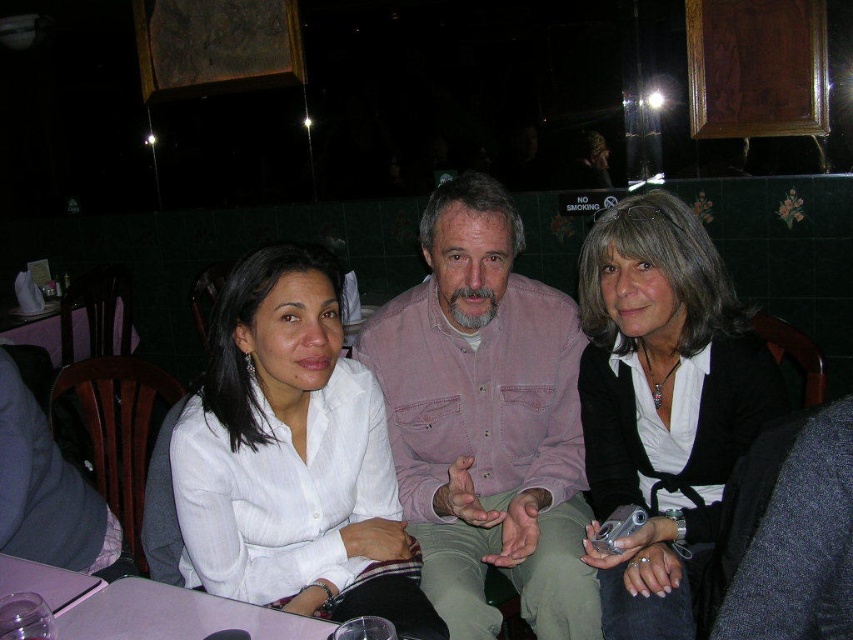
In the scene shown: You are standing in the restaurant and want to hand a menu to the person wearing the pink cotton shirt at center. Based on their position, where should you approach them from?

The pink cotton shirt at center is positioned at point 0.658 on the x axis and 0.571 on the y axis, so you should approach them from the left side since their x coordinate is closer to the right side of the image.

You are standing in the restaurant and want to hand a menu to the person wearing the pink cotton shirt at center. Based on their position, where should you walk to find them?

The pink cotton shirt at center is located at the coordinates point (x=486, y=420), so you should walk towards the center area of the restaurant where the pink cotton shirt at center is positioned.